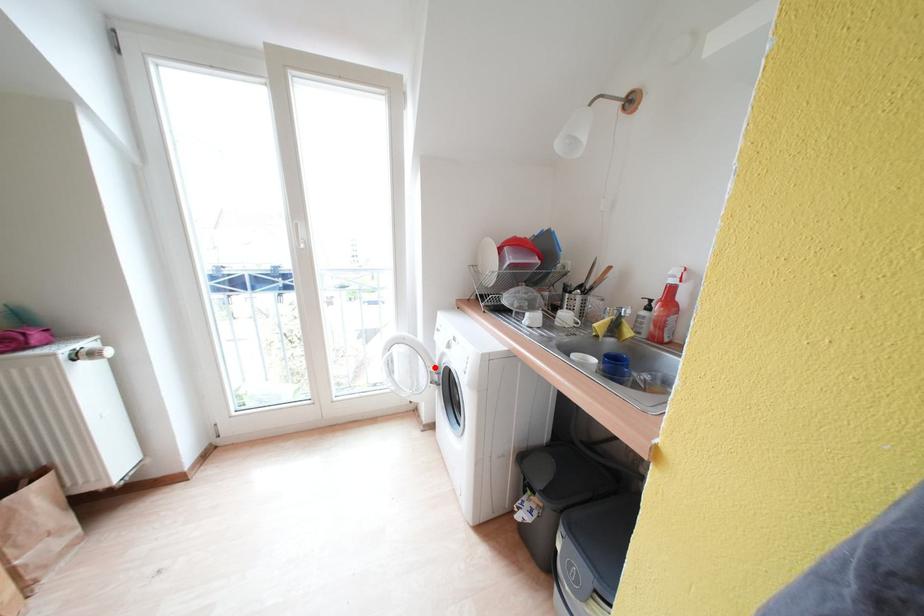
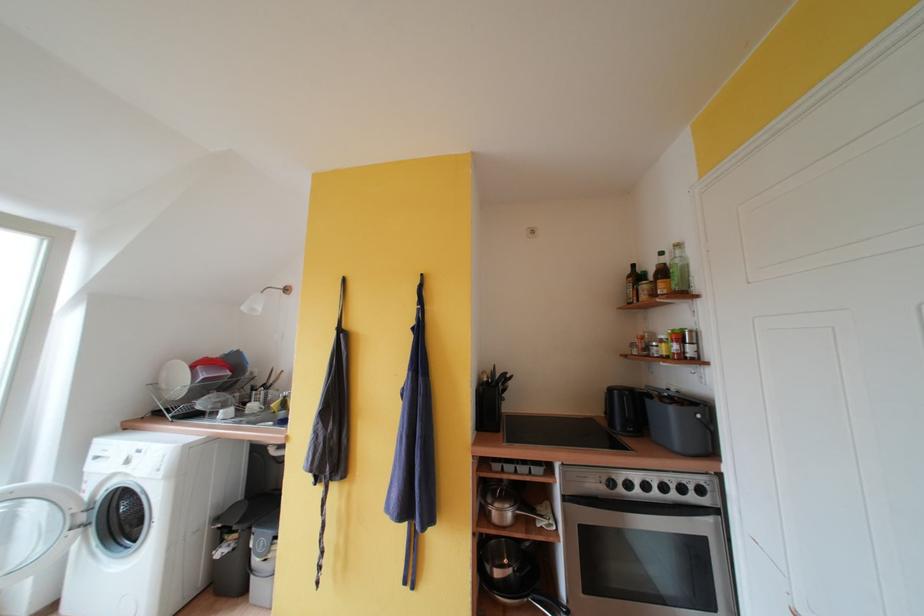
The point at the highlighted location is marked in the first image. Where is the corresponding point in the second image?

(76, 509)